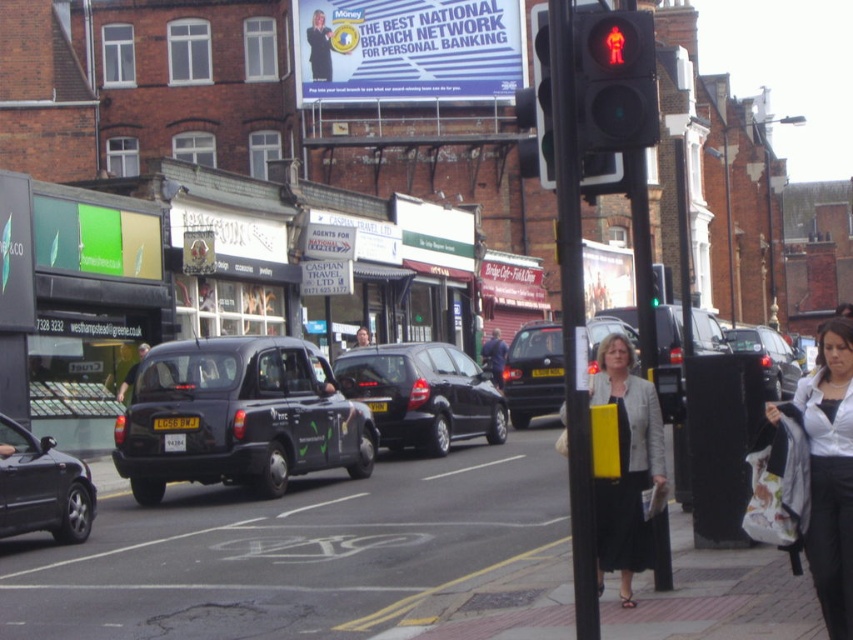
Which is more to the right, red glass pedestrian signal at upper center or smooth black suit at center?

Positioned to the right is red glass pedestrian signal at upper center.

Can you confirm if red glass pedestrian signal at upper center is taller than smooth black suit at center?

In fact, red glass pedestrian signal at upper center may be shorter than smooth black suit at center.

Image resolution: width=853 pixels, height=640 pixels. Describe the element at coordinates (614, 81) in the screenshot. I see `red glass pedestrian signal at upper center` at that location.

The width and height of the screenshot is (853, 640). What are the coordinates of `red glass pedestrian signal at upper center` in the screenshot? It's located at (614, 81).

Is red glass pedestrian signal at upper right to the right of smooth black suit at center from the viewer's perspective?

Indeed, red glass pedestrian signal at upper right is positioned on the right side of smooth black suit at center.

Between red glass pedestrian signal at upper right and smooth black suit at center, which one appears on the right side from the viewer's perspective?

From the viewer's perspective, red glass pedestrian signal at upper right appears more on the right side.

Looking at this image, who is more forward, (x=612, y=172) or (x=321, y=26)?

Point (x=612, y=172)

What are the coordinates of `red glass pedestrian signal at upper right` in the screenshot? It's located at (541, 99).

The height and width of the screenshot is (640, 853). I want to click on red glass pedestrian signal at upper center, so click(x=614, y=81).

Is red glass pedestrian signal at upper center below green glass traffic light at upper center?

Actually, red glass pedestrian signal at upper center is above green glass traffic light at upper center.

This screenshot has height=640, width=853. I want to click on red glass pedestrian signal at upper center, so click(x=614, y=81).